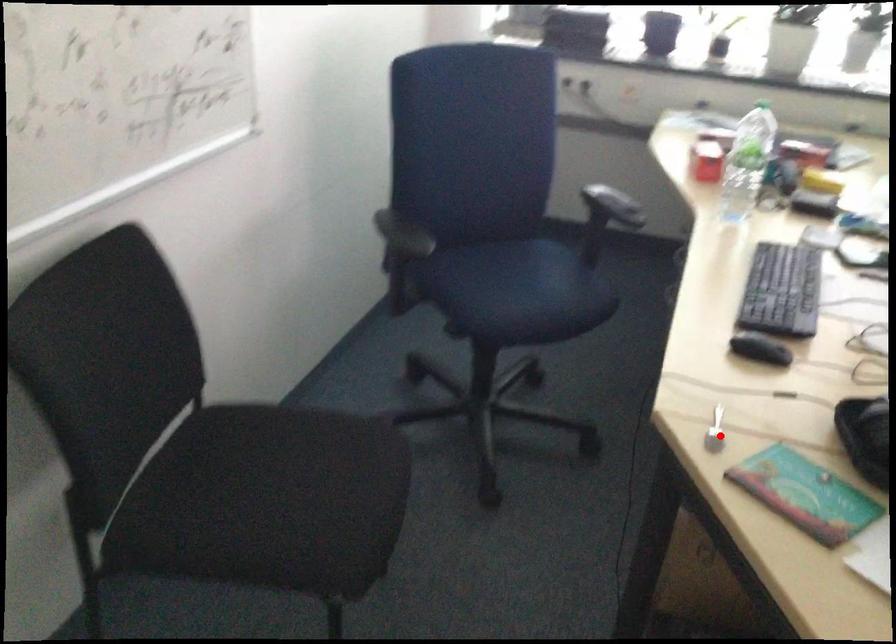
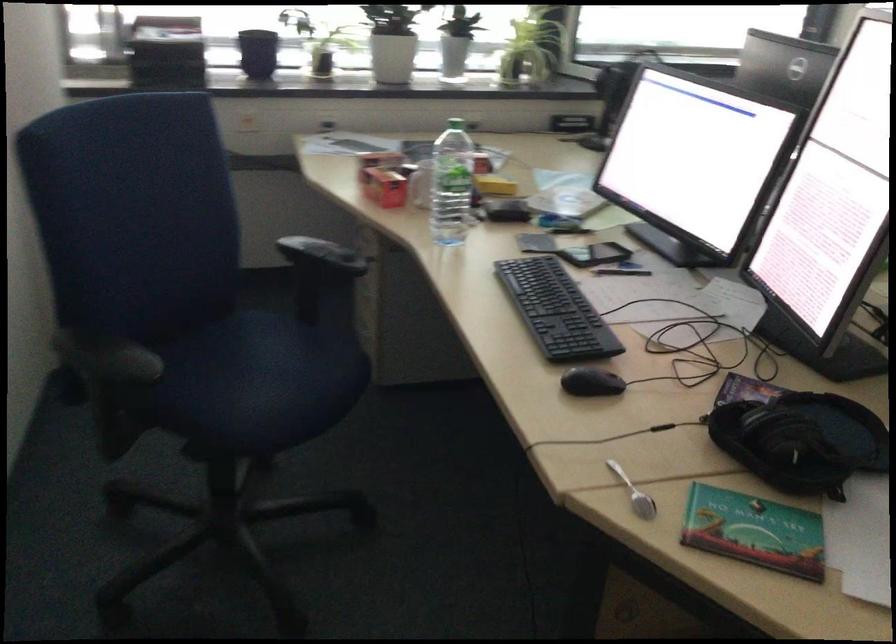
Where in the second image is the point corresponding to the highlighted location from the first image?

(633, 494)